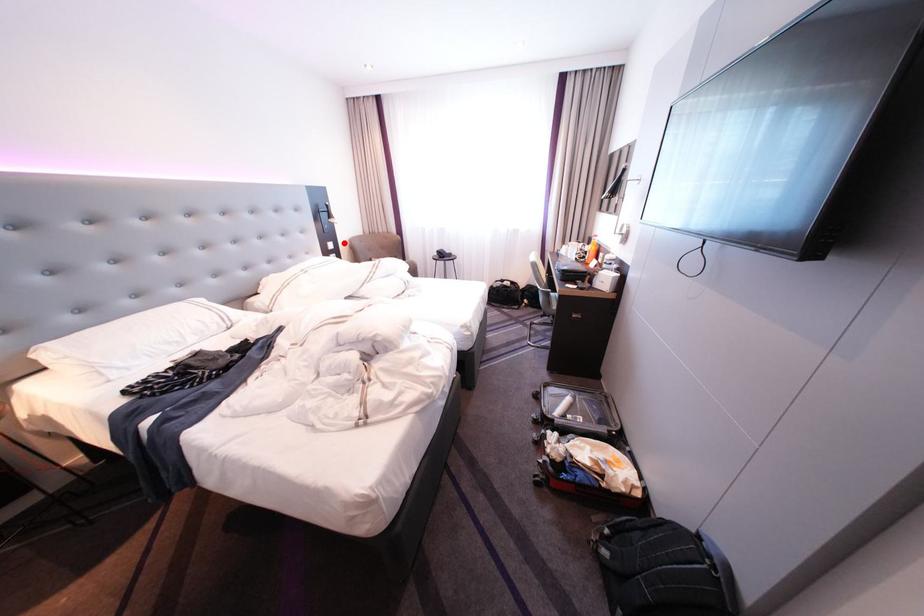
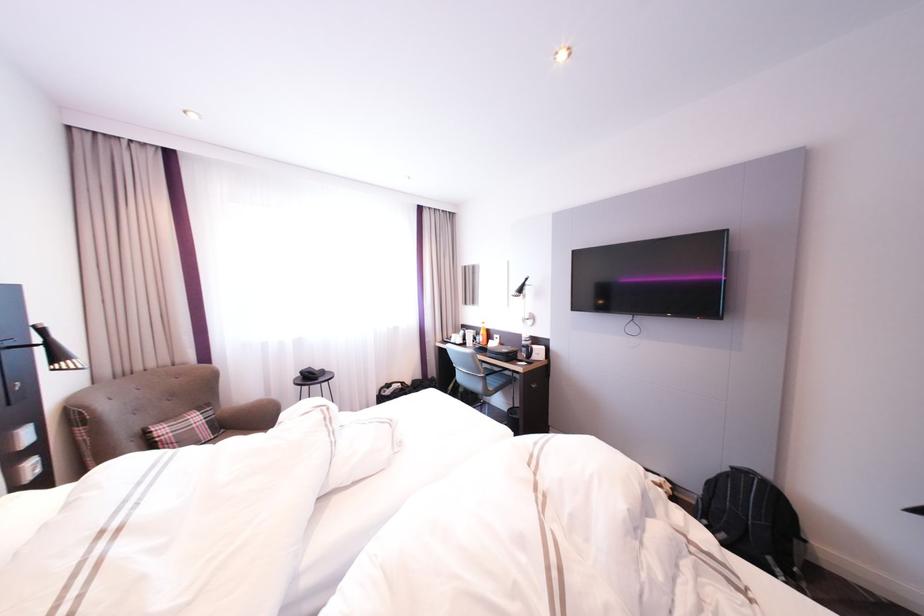
Question: I am providing you with two images of the same scene from different viewpoints. Given a red point in image1, look at the same physical point in image2. Is it:

Choices:
 (A) Closer to the viewpoint
 (B) Farther from the viewpoint

Answer: (B)